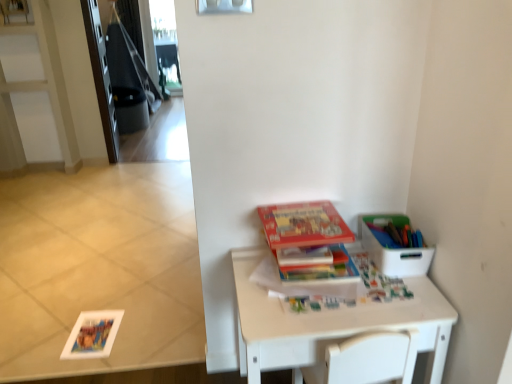
Question: From a real-world perspective, is white plastic container at right under white matte table at lower right?

Choices:
 (A) yes
 (B) no

Answer: (B)

Question: Is white plastic container at right thinner than white matte table at lower right?

Choices:
 (A) yes
 (B) no

Answer: (A)

Question: Can you confirm if white plastic container at right is wider than white matte table at lower right?

Choices:
 (A) yes
 (B) no

Answer: (B)

Question: Does white plastic container at right have a greater height compared to white matte table at lower right?

Choices:
 (A) no
 (B) yes

Answer: (A)

Question: Considering the relative sizes of white plastic container at right and white matte table at lower right in the image provided, is white plastic container at right bigger than white matte table at lower right?

Choices:
 (A) yes
 (B) no

Answer: (B)

Question: Considering the positions of white matte table at lower right and matte cardboard book at center, the first paperback book in the top-to-bottom sequence, in the image, is white matte table at lower right wider or thinner than matte cardboard book at center, the first paperback book in the top-to-bottom sequence,?

Choices:
 (A) thin
 (B) wide

Answer: (B)

Question: Is point (248, 352) positioned closer to the camera than point (286, 205)?

Choices:
 (A) farther
 (B) closer

Answer: (B)

Question: Would you say white matte table at lower right is to the left or to the right of matte cardboard book at center, the first paperback book in the top-to-bottom sequence, in the picture?

Choices:
 (A) left
 (B) right

Answer: (B)

Question: Is white matte table at lower right bigger or smaller than matte cardboard book at center, the first paperback book in the top-to-bottom sequence?

Choices:
 (A) small
 (B) big

Answer: (B)

Question: Is white matte table at lower right wider or thinner than white plastic container at right?

Choices:
 (A) wide
 (B) thin

Answer: (A)

Question: Based on their sizes in the image, would you say white matte table at lower right is bigger or smaller than white plastic container at right?

Choices:
 (A) big
 (B) small

Answer: (A)

Question: Is white matte table at lower right inside the boundaries of white plastic container at right, or outside?

Choices:
 (A) outside
 (B) inside

Answer: (A)

Question: From a real-world perspective, relative to white plastic container at right, is white matte table at lower right vertically above or below?

Choices:
 (A) above
 (B) below

Answer: (B)

Question: Does point (377, 266) appear closer or farther from the camera than point (309, 269)?

Choices:
 (A) closer
 (B) farther

Answer: (B)

Question: Would you say white plastic container at right is to the left or to the right of hardcover book at center, the 2th paperback book from the top, in the picture?

Choices:
 (A) left
 (B) right

Answer: (B)